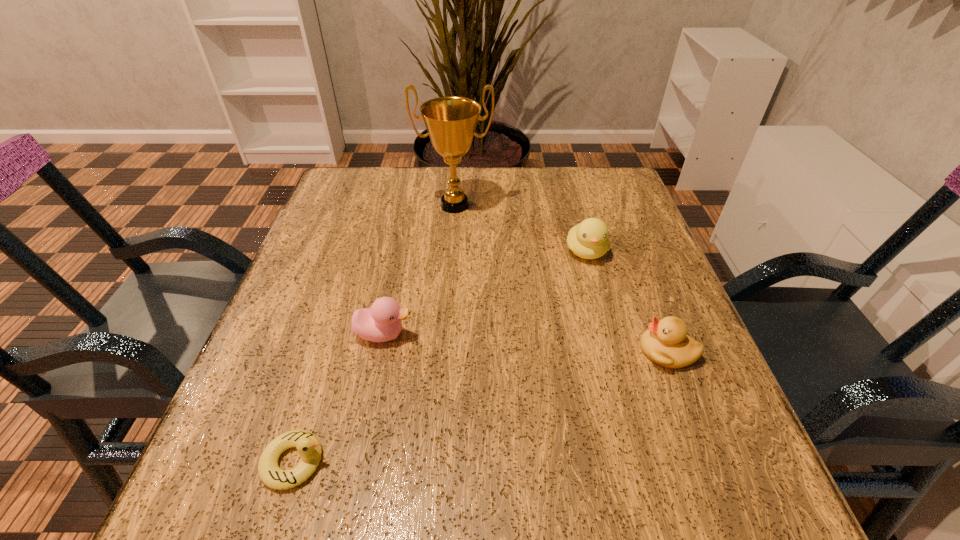
Identify the location of free space between the third duckling from left to right and the award. This screenshot has height=540, width=960. (520, 228).

This screenshot has width=960, height=540. Find the location of `object that stands as the closest to the farthest object`. object that stands as the closest to the farthest object is located at coordinates (589, 239).

At what (x,y) coordinates should I click in order to perform the action: click on object that is the fourth closest to the rightmost duckling. Please return your answer as a coordinate pair (x, y). Looking at the image, I should click on (308, 446).

Locate an element on the screen. The image size is (960, 540). duckling that can be found as the closest to the shortest object is located at coordinates (382, 322).

Where is `duckling that is the third closest one to the nearest duckling`? Image resolution: width=960 pixels, height=540 pixels. duckling that is the third closest one to the nearest duckling is located at coordinates (589, 239).

Image resolution: width=960 pixels, height=540 pixels. I want to click on free space that satisfies the following two spatial constraints: 1. on the front view with handles of the farthest object; 2. on the face of the shortest object, so click(436, 462).

This screenshot has width=960, height=540. I want to click on free region that satisfies the following two spatial constraints: 1. on the front view with handles of the award; 2. on the face of the shortest object, so click(436, 462).